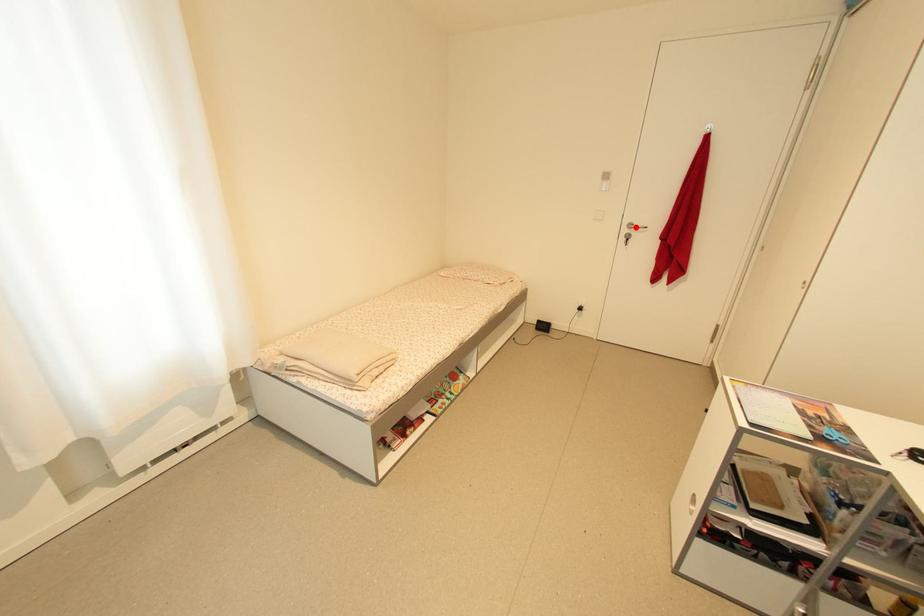
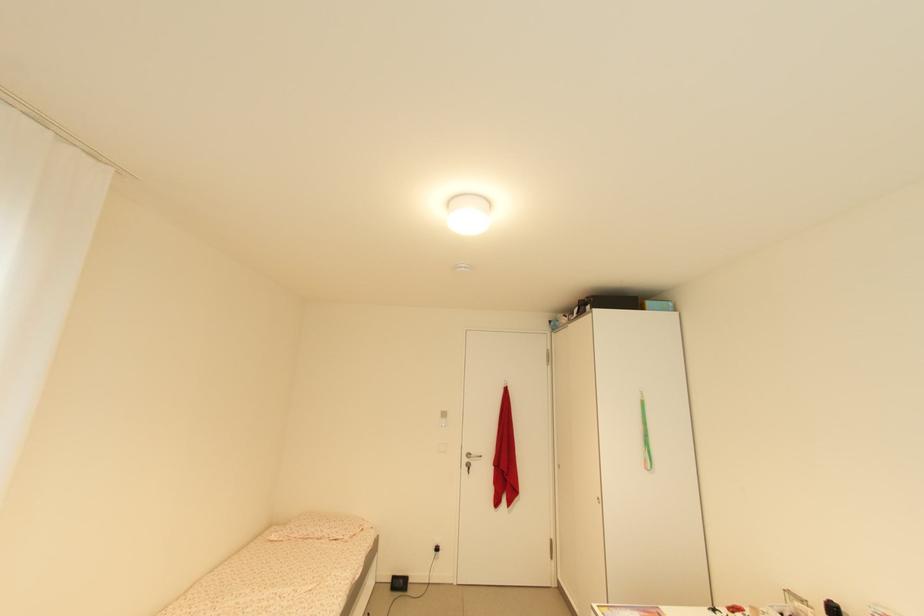
Question: A red point is marked in image1. In image2, is the corresponding 3D point closer to the camera or farther? Reply with the corresponding letter.

Choices:
 (A) The corresponding 3D point is closer.
 (B) The corresponding 3D point is farther.

Answer: (B)